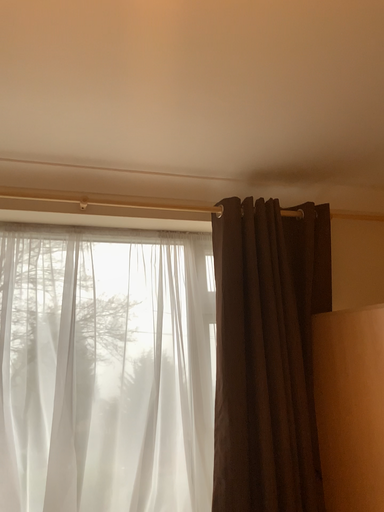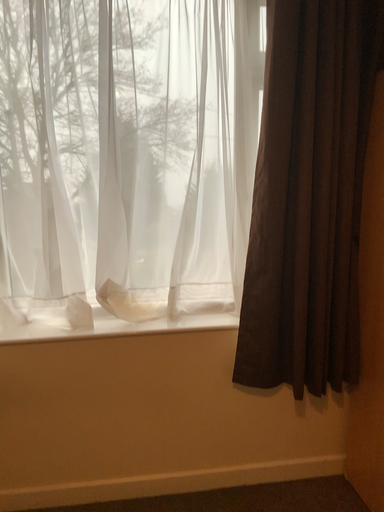
Question: Which way did the camera rotate in the video?

Choices:
 (A) rotated right
 (B) rotated left

Answer: (B)